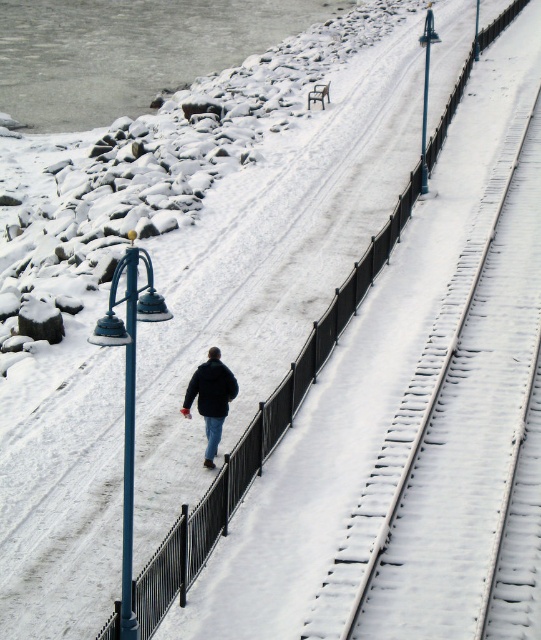
Which is more to the left, dark blue jacket at center or black matte jacket at center?

dark blue jacket at center is more to the left.

Can you confirm if dark blue jacket at center is positioned below black matte jacket at center?

Yes.

Who is more forward, (194,381) or (215,368)?

Point (215,368) is more forward.

Locate an element on the screen. dark blue jacket at center is located at coordinates (210, 397).